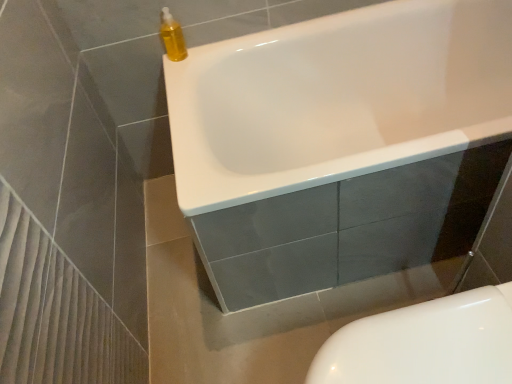
Where is `vacant region to the right of yellow translucent bottle at upper left`? vacant region to the right of yellow translucent bottle at upper left is located at coordinates (209, 46).